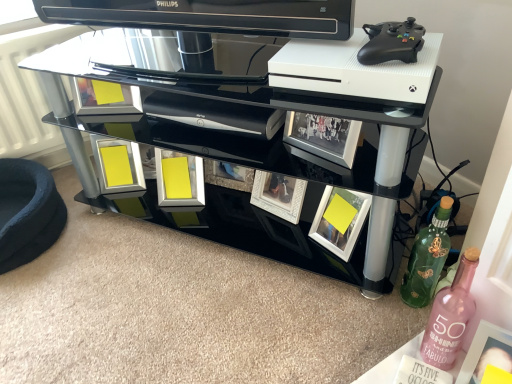
I want to click on free spot to the right of velvet cushion at lower left, so click(115, 235).